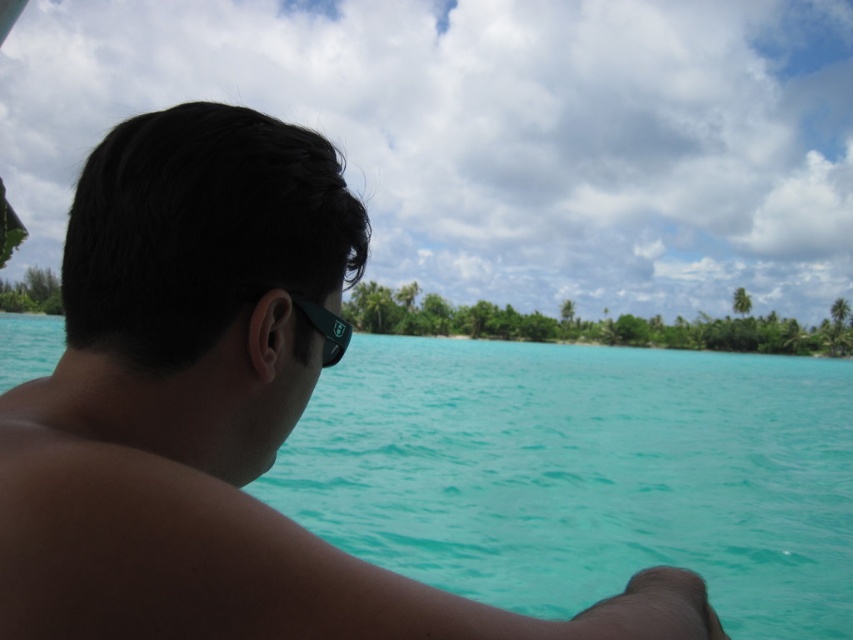
Between point (209, 332) and point (323, 364), which one is positioned behind?

Point (323, 364)

Is matte black sunglasses at upper left positioned before black rubber goggles at ear?

Yes, it is.

Is point (20, 452) positioned in front of point (328, 317)?

Yes, point (20, 452) is in front of point (328, 317).

What are the coordinates of `matte black sunglasses at upper left` in the screenshot? It's located at (216, 413).